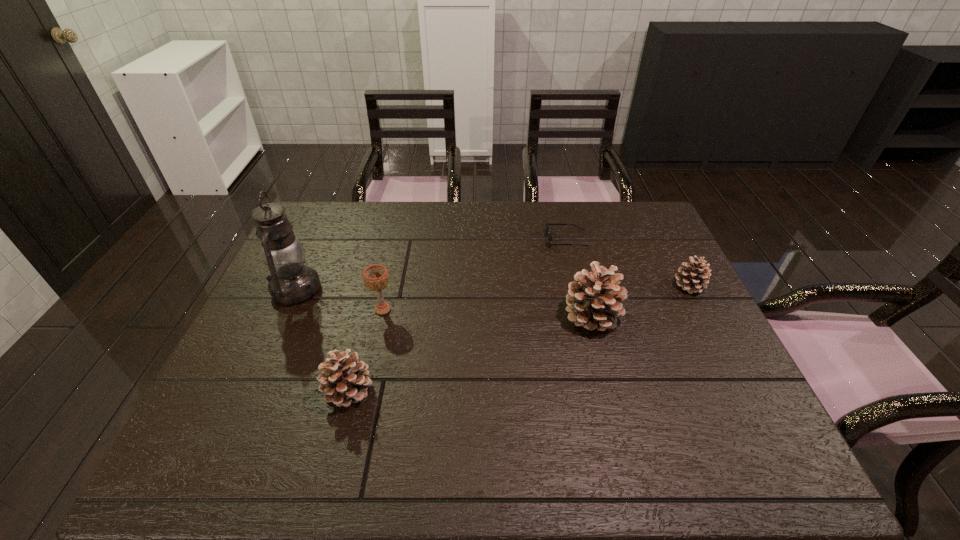
Select which object appears as the third closest to the second pinecone from left to right. Please provide its 2D coordinates. Your answer should be formatted as a tuple, i.e. [(x, y)], where the tuple contains the x and y coordinates of a point satisfying the conditions above.

[(375, 277)]

Identify the location of the second closest object to the sunglasses. The height and width of the screenshot is (540, 960). [694, 278].

The height and width of the screenshot is (540, 960). In order to click on pinecone that stands as the second closest to the leftmost pinecone in this screenshot , I will do `click(694, 278)`.

Find the location of a particular element. pinecone that stands as the third closest to the oil lamp is located at coordinates (694, 278).

You are a GUI agent. You are given a task and a screenshot of the screen. Output one action in this format:
    pyautogui.click(x=<x>, y=<y>)
    Task: Click on the free space that satisfies the following two spatial constraints: 1. on the front side of the oil lamp; 2. on the left side of the second pinecone from right to left
    
    Given the screenshot: What is the action you would take?
    pyautogui.click(x=284, y=316)

The image size is (960, 540). In order to click on free point that satisfies the following two spatial constraints: 1. on the front-facing side of the sunglasses; 2. on the back side of the fifth tallest object in this screenshot , I will do `click(577, 286)`.

Locate an element on the screen. vacant area in the image that satisfies the following two spatial constraints: 1. on the front-facing side of the shortest object; 2. on the right side of the fifth shortest object is located at coordinates (585, 316).

Locate an element on the screen. free location that satisfies the following two spatial constraints: 1. on the front side of the fifth shortest object; 2. on the left side of the chalice is located at coordinates (381, 316).

You are a GUI agent. You are given a task and a screenshot of the screen. Output one action in this format:
    pyautogui.click(x=<x>, y=<y>)
    Task: Click on the free space that satisfies the following two spatial constraints: 1. on the front-facing side of the farthest object; 2. on the right side of the rightmost pinecone
    Image resolution: width=960 pixels, height=540 pixels.
    Given the screenshot: What is the action you would take?
    pyautogui.click(x=577, y=286)

Locate an element on the screen. The height and width of the screenshot is (540, 960). vacant position in the image that satisfies the following two spatial constraints: 1. on the back side of the shortest pinecone; 2. on the right side of the fifth shortest object is located at coordinates (585, 286).